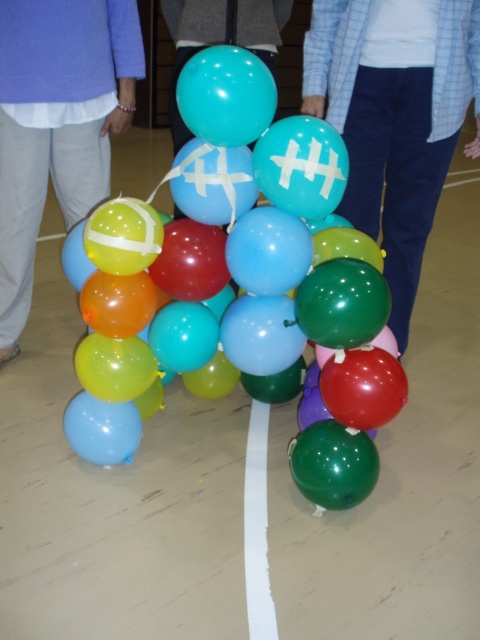
Question: Considering the relative positions of glossy rubber balloons at center and glossy teal balloon at center in the image provided, where is glossy rubber balloons at center located with respect to glossy teal balloon at center?

Choices:
 (A) below
 (B) above

Answer: (A)

Question: Which of the following is the closest to the observer?

Choices:
 (A) (168, 337)
 (B) (389, 192)
 (C) (288, 13)
 (D) (74, 44)

Answer: (A)

Question: From the image, what is the correct spatial relationship of glossy rubber balloons at center in relation to matte blue pants at lower left?

Choices:
 (A) right
 (B) left

Answer: (A)

Question: Which point is closer to the camera taking this photo?

Choices:
 (A) coord(254,36)
 (B) coord(139,378)

Answer: (B)

Question: Among these objects, which one is nearest to the camera?

Choices:
 (A) blue plaid shirt at center
 (B) matte blue pants at lower left

Answer: (A)

Question: Is the position of glossy rubber balloons at center less distant than that of matte blue pants at lower left?

Choices:
 (A) yes
 (B) no

Answer: (A)